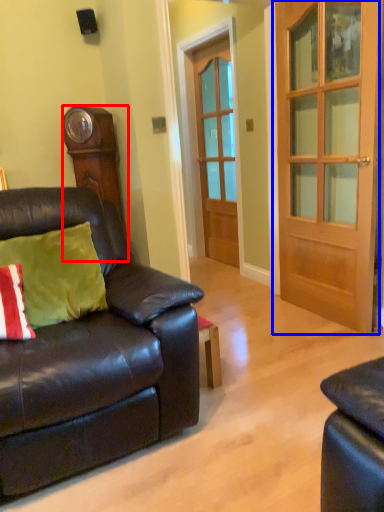
Question: Which point is further to the camera, cabinetry (highlighted by a red box) or door (highlighted by a blue box)?

Choices:
 (A) cabinetry
 (B) door

Answer: (A)